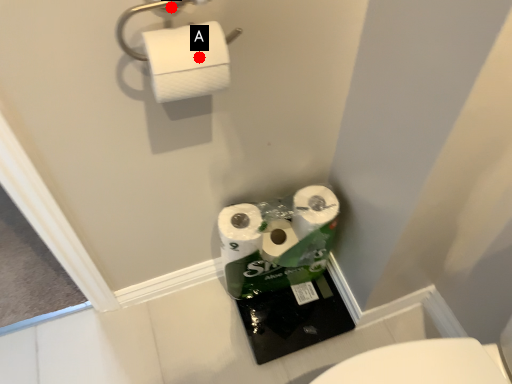
Question: Two points are circled on the image, labeled by A and B beside each circle. Which of the following is the closest to the observer?

Choices:
 (A) A is closer
 (B) B is closer

Answer: (A)